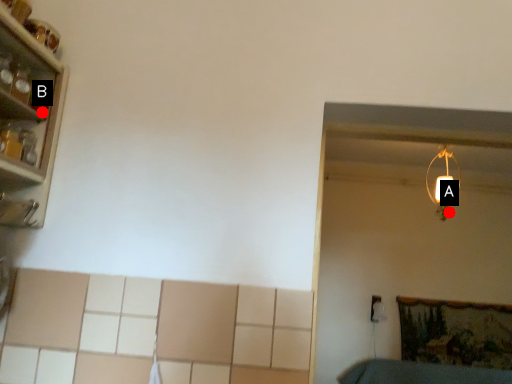
Question: Two points are circled on the image, labeled by A and B beside each circle. Among these points, which one is farthest from the camera?

Choices:
 (A) A is further
 (B) B is further

Answer: (A)